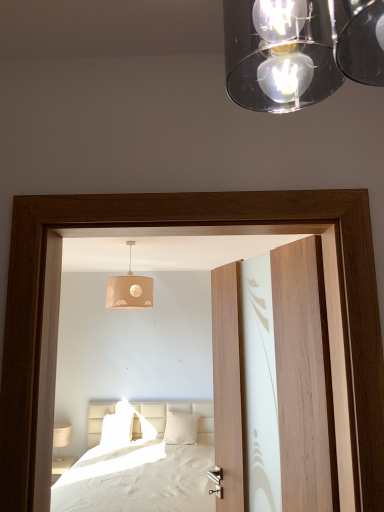
Measure the distance between white fabric table lamp at lower left and camera.

The depth of white fabric table lamp at lower left is 17.07 feet.

What do you see at coordinates (141, 466) in the screenshot?
I see `white quilted bed at center` at bounding box center [141, 466].

Measure the distance between point (195, 416) and camera.

The depth of point (195, 416) is 5.23 meters.

Measure the distance between white textured pillow at center, positioned as the first pillow in right-to-left order, and camera.

4.60 meters.

The image size is (384, 512). What do you see at coordinates (129, 290) in the screenshot?
I see `beige fabric lampshade at center` at bounding box center [129, 290].

In order to face transparent glass door at center, should I rotate leftwards or rightwards?

Turn left approximately 1.402 degrees to face it.

Identify the location of white matte pillow at center, positioned as the 1th pillow in left-to-right order. This screenshot has height=512, width=384. (117, 429).

Measure the distance between white matte pillow at center, positioned as the 1th pillow in left-to-right order, and camera.

They are 14.83 feet apart.

Where is `white fabric table lamp at lower left`? The width and height of the screenshot is (384, 512). white fabric table lamp at lower left is located at coordinates (61, 438).

From the image's perspective, who appears lower, white quilted bed at center or white matte pillow at center, the 2th pillow from the right?

white quilted bed at center.

Is white quilted bed at center aimed at white matte pillow at center, the 2th pillow from the right?

No, white quilted bed at center is not oriented towards white matte pillow at center, the 2th pillow from the right.

Image resolution: width=384 pixels, height=512 pixels. Find the location of `the 1st pillow above the white quilted bed at center (from a real-world perspective)`. the 1st pillow above the white quilted bed at center (from a real-world perspective) is located at coordinates (117, 429).

Does white quilted bed at center appear on the left side of white matte pillow at center, the 2th pillow from the right?

In fact, white quilted bed at center is to the right of white matte pillow at center, the 2th pillow from the right.

In the image, is wooden door at center positioned in front of or behind white quilted bed at center?

wooden door at center is in front of white quilted bed at center.

Can you tell me how much wooden door at center and white quilted bed at center differ in facing direction?

There is a 65.9-degree angle between the facing directions of wooden door at center and white quilted bed at center.

Considering the sizes of objects wooden door at center and white quilted bed at center in the image provided, who is bigger, wooden door at center or white quilted bed at center?

Bigger between the two is white quilted bed at center.

Locate an element on the screen. This screenshot has height=512, width=384. bed that appears on the left of wooden door at center is located at coordinates (141, 466).

How far apart are white quilted bed at center and white textured pillow at center, positioned as the first pillow in right-to-left order?

24.34 inches.

Considering the positions of points (62, 483) and (183, 417), is point (62, 483) farther from camera compared to point (183, 417)?

No, (62, 483) is closer to viewer.

From the image's perspective, which one is positioned lower, white quilted bed at center or white textured pillow at center, positioned as the first pillow in right-to-left order?

From the image's view, white quilted bed at center is below.

From a real-world perspective, is white quilted bed at center above or below white textured pillow at center, which is the 2th pillow from left to right?

white quilted bed at center is situated lower than white textured pillow at center, which is the 2th pillow from left to right, in the real world.

Is white fabric table lamp at lower left positioned with its back to beige fabric lampshade at center?

No, beige fabric lampshade at center is not at the back of white fabric table lamp at lower left.

Who is bigger, white fabric table lamp at lower left or beige fabric lampshade at center?

beige fabric lampshade at center.

Is white fabric table lamp at lower left far away from beige fabric lampshade at center?

Yes, white fabric table lamp at lower left is far from beige fabric lampshade at center.

Based on the photo, is white fabric table lamp at lower left taller than beige fabric lampshade at center?

In fact, white fabric table lamp at lower left may be shorter than beige fabric lampshade at center.

Is white matte pillow at center, positioned as the 1th pillow in left-to-right order, placed right next to beige fabric lampshade at center?

white matte pillow at center, positioned as the 1th pillow in left-to-right order, and beige fabric lampshade at center are clearly separated.

Which object is more forward, white matte pillow at center, positioned as the 1th pillow in left-to-right order, or beige fabric lampshade at center?

beige fabric lampshade at center is closer to the camera.

Where is `pillow on the left of beige fabric lampshade at center`? The width and height of the screenshot is (384, 512). pillow on the left of beige fabric lampshade at center is located at coordinates [117, 429].

Are white matte pillow at center, positioned as the 1th pillow in left-to-right order, and white textured pillow at center, positioned as the first pillow in right-to-left order, far apart?

They are positioned close to each other.

From the image's perspective, is white matte pillow at center, positioned as the 1th pillow in left-to-right order, beneath white textured pillow at center, positioned as the first pillow in right-to-left order?

Yes.

Based on their sizes in the image, would you say white matte pillow at center, positioned as the 1th pillow in left-to-right order, is bigger or smaller than white textured pillow at center, positioned as the first pillow in right-to-left order?

Clearly, white matte pillow at center, positioned as the 1th pillow in left-to-right order, is smaller in size than white textured pillow at center, positioned as the first pillow in right-to-left order.

The image size is (384, 512). I want to click on pillow lying on the left of white textured pillow at center, positioned as the first pillow in right-to-left order, so click(x=117, y=429).

Considering the points (136, 294) and (239, 425), which point is in front, point (136, 294) or point (239, 425)?

The point (239, 425) is in front.

Identify the location of door on the right side of beige fabric lampshade at center. Image resolution: width=384 pixels, height=512 pixels. [303, 378].

How different are the orientations of beige fabric lampshade at center and wooden door at center in degrees?

67.6 degrees.

Who is smaller, beige fabric lampshade at center or wooden door at center?

beige fabric lampshade at center.

The image size is (384, 512). In order to click on bed below the white matte pillow at center, the 2th pillow from the right (from the image's perspective) in this screenshot , I will do `click(141, 466)`.

Where is `bed to the left of wooden door at center`? Image resolution: width=384 pixels, height=512 pixels. bed to the left of wooden door at center is located at coordinates pos(141,466).

Estimate the real-world distances between objects in this image. Which object is further from white fabric table lamp at lower left, white textured pillow at center, positioned as the first pillow in right-to-left order, or transparent glass door at center?

Among the two, transparent glass door at center is located further to white fabric table lamp at lower left.

Which object lies further to the anchor point white fabric table lamp at lower left, white quilted bed at center or beige fabric lampshade at center?

Among the two, beige fabric lampshade at center is located further to white fabric table lamp at lower left.

Based on their spatial positions, is white textured pillow at center, which is the 2th pillow from left to right, or white matte pillow at center, positioned as the 1th pillow in left-to-right order, closer to wooden door at center?

white textured pillow at center, which is the 2th pillow from left to right, is closer to wooden door at center.

Looking at the image, which one is located further to white quilted bed at center, white fabric table lamp at lower left or transparent glass door at center?

white fabric table lamp at lower left is positioned further to the anchor white quilted bed at center.

Estimate the real-world distances between objects in this image. Which object is further from white textured pillow at center, positioned as the first pillow in right-to-left order, beige fabric lampshade at center or white matte pillow at center, the 2th pillow from the right?

beige fabric lampshade at center is further to white textured pillow at center, positioned as the first pillow in right-to-left order.

Looking at the image, which one is located further to wooden door at center, white fabric table lamp at lower left or white matte pillow at center, the 2th pillow from the right?

The object further to wooden door at center is white fabric table lamp at lower left.

From the picture: From the image, which object appears to be farther from beige fabric lampshade at center, white matte pillow at center, the 2th pillow from the right, or white fabric table lamp at lower left?

white fabric table lamp at lower left is positioned further to the anchor beige fabric lampshade at center.

When comparing their distances from transparent glass door at center, does white textured pillow at center, which is the 2th pillow from left to right, or white fabric table lamp at lower left seem further?

white fabric table lamp at lower left.

You are a GUI agent. You are given a task and a screenshot of the screen. Output one action in this format:
    pyautogui.click(x=<x>, y=<y>)
    Task: Click on the pillow between beige fabric lampshade at center and white matte pillow at center, the 2th pillow from the right, in the vertical direction
    The width and height of the screenshot is (384, 512).
    Given the screenshot: What is the action you would take?
    pyautogui.click(x=181, y=428)

I want to click on door between transparent glass door at center and white quilted bed at center vertically, so click(x=303, y=378).

This screenshot has height=512, width=384. Identify the location of bed between transparent glass door at center and white fabric table lamp at lower left along the z-axis. (141, 466).

Locate an element on the screen. lamp between white quilted bed at center and white textured pillow at center, which is the 2th pillow from left to right, along the z-axis is located at coordinates (129, 290).